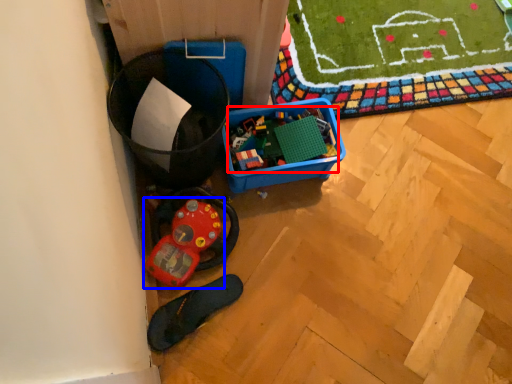
Question: Which of the following is the farthest to the observer, toy (highlighted by a red box) or toy (highlighted by a blue box)?

Choices:
 (A) toy
 (B) toy

Answer: (A)